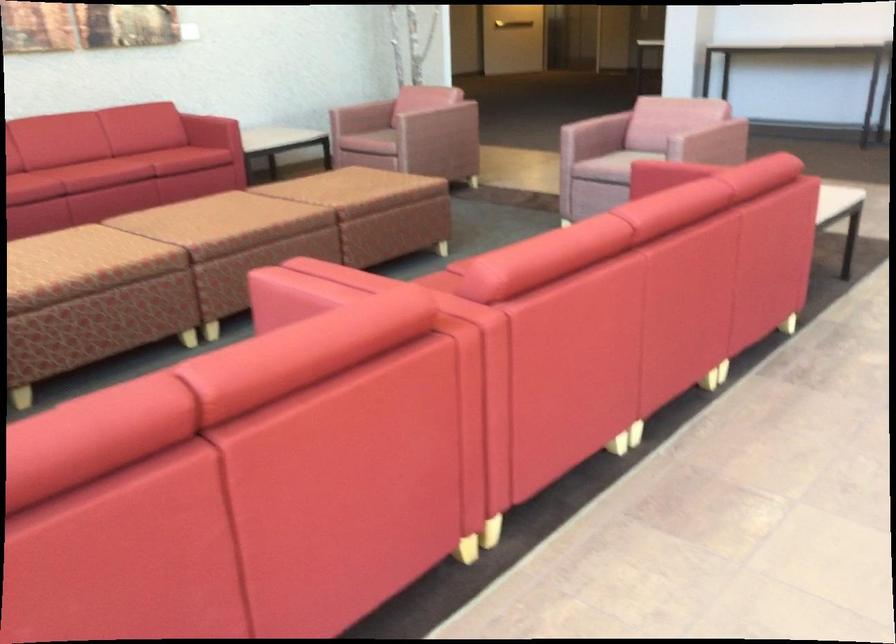
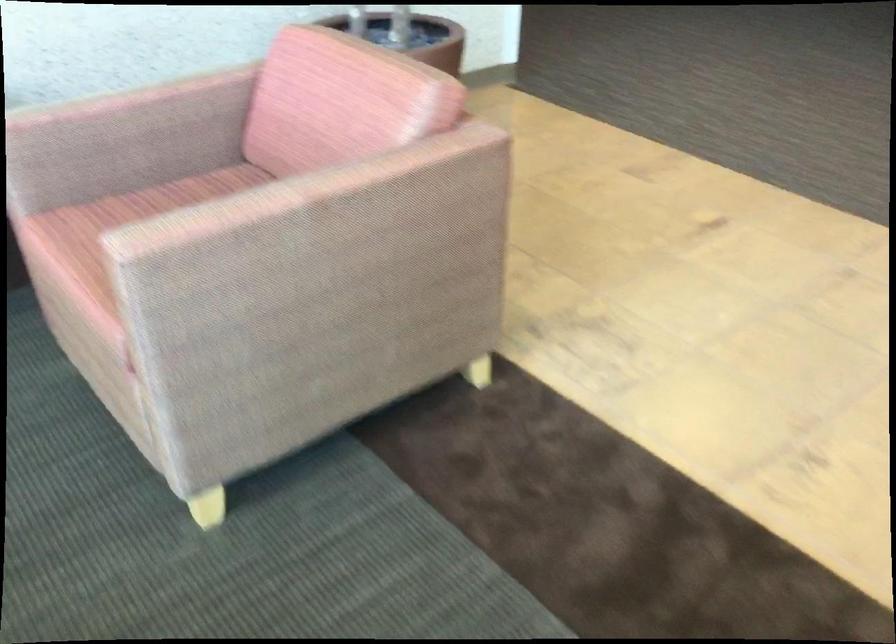
In the second image, find the point that corresponds to (x=433, y=106) in the first image.

(298, 192)